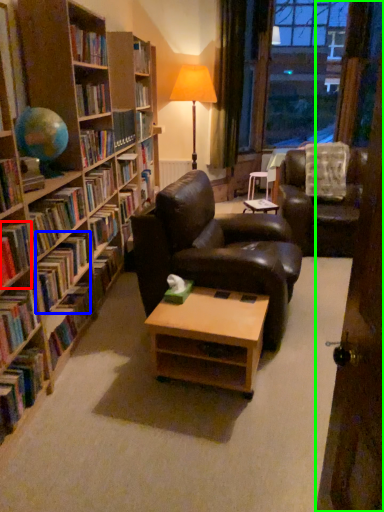
Question: Estimate the real-world distances between objects in this image. Which object is farther from book (highlighted by a red box), book (highlighted by a blue box) or door (highlighted by a green box)?

Choices:
 (A) book
 (B) door

Answer: (B)